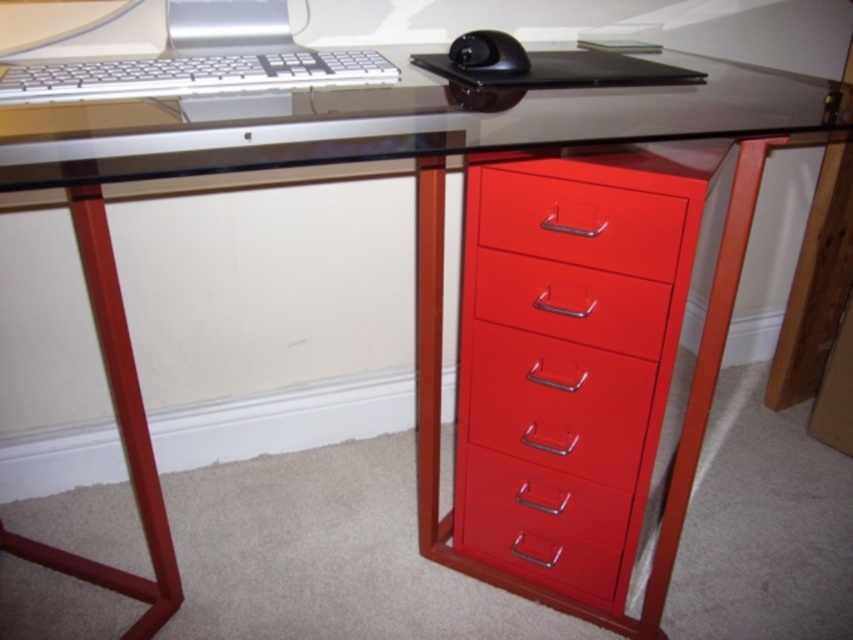
Is metallic red file cabinet at right to the right of silver metallic keyboard at upper left from the viewer's perspective?

Yes, metallic red file cabinet at right is to the right of silver metallic keyboard at upper left.

Is point (640, 410) positioned in front of point (178, 93)?

No, it is not.

Identify the location of metallic red file cabinet at right. The width and height of the screenshot is (853, 640). (569, 358).

What do you see at coordinates (581, 221) in the screenshot? I see `glossy red drawer at right` at bounding box center [581, 221].

Does glossy red drawer at right have a lesser height compared to glossy red drawer at center?

In fact, glossy red drawer at right may be taller than glossy red drawer at center.

Measure the distance between glossy red drawer at right and camera.

glossy red drawer at right is 33.25 inches away from camera.

At what (x,y) coordinates should I click in order to perform the action: click on glossy red drawer at right. Please return your answer as a coordinate pair (x, y). This screenshot has height=640, width=853. Looking at the image, I should click on (581, 221).

Who is positioned more to the left, metallic red file cabinet at right or black glossy mouse at upper center?

From the viewer's perspective, black glossy mouse at upper center appears more on the left side.

Which is below, metallic red file cabinet at right or black glossy mouse at upper center?

metallic red file cabinet at right

Where is `metallic red file cabinet at right`? This screenshot has width=853, height=640. metallic red file cabinet at right is located at coordinates (569, 358).